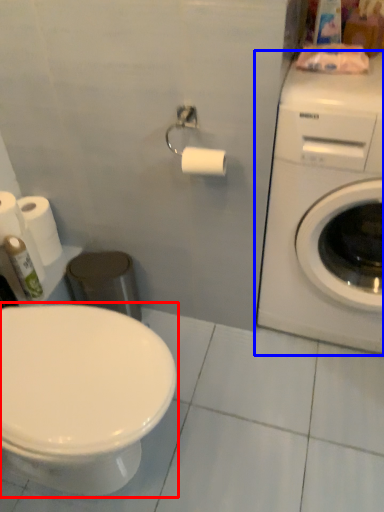
Question: Which object is further to the camera taking this photo, toilet (highlighted by a red box) or washing machine (highlighted by a blue box)?

Choices:
 (A) toilet
 (B) washing machine

Answer: (B)